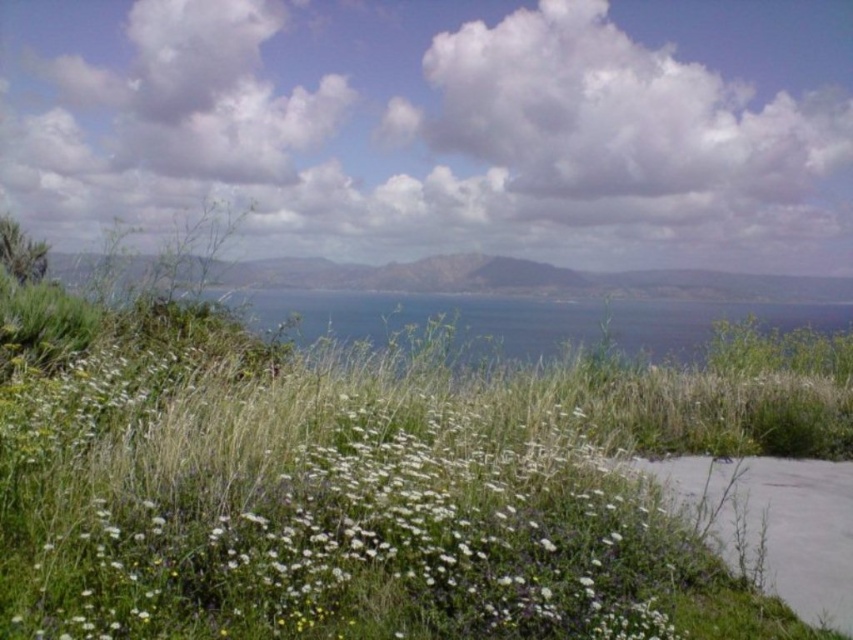
Can you confirm if white fluffy cloud at upper center is smaller than white fluffy flowers at center?

No.

Is white fluffy cloud at upper center thinner than white fluffy flowers at center?

No.

Locate an element on the screen. The width and height of the screenshot is (853, 640). white fluffy cloud at upper center is located at coordinates (440, 128).

Where is `white fluffy cloud at upper center`? This screenshot has width=853, height=640. white fluffy cloud at upper center is located at coordinates (440, 128).

Identify the location of white fluffy cloud at upper center. This screenshot has height=640, width=853. (440, 128).

Is the position of white fluffy cloud at upper center more distant than that of gray concrete path at lower right?

Yes, it is behind gray concrete path at lower right.

Which is behind, point (440, 218) or point (804, 563)?

Positioned behind is point (440, 218).

The height and width of the screenshot is (640, 853). In order to click on white fluffy cloud at upper center in this screenshot , I will do `click(440, 128)`.

Does white fluffy flowers at center come in front of gray concrete path at lower right?

Yes, white fluffy flowers at center is in front of gray concrete path at lower right.

Is point (445, 570) closer to camera compared to point (784, 541)?

Yes, point (445, 570) is in front of point (784, 541).

Find the location of `white fluffy flowers at center`. white fluffy flowers at center is located at coordinates (369, 547).